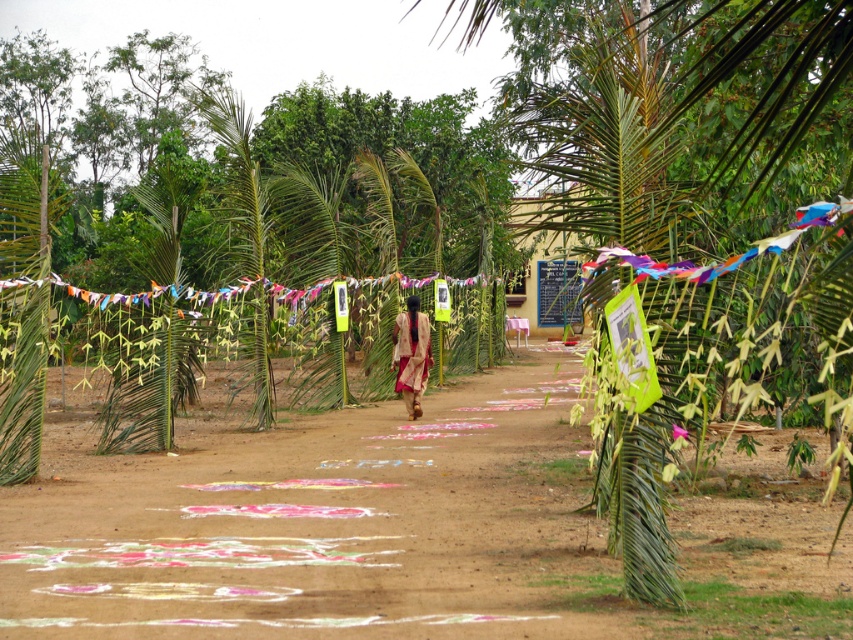
Question: Which object is the farthest from the green leafy fence at center?

Choices:
 (A) matte pink saree at center
 (B) green leafy palm tree at center
 (C) colorful fabric banner at center
 (D) colored sand art at center

Answer: (B)

Question: Which of the following is the farthest from the observer?

Choices:
 (A) click(x=646, y=230)
 (B) click(x=511, y=568)
 (C) click(x=184, y=317)
 (D) click(x=430, y=349)

Answer: (D)

Question: Can you confirm if green leafy palm tree at center is smaller than colorful fabric banner at center?

Choices:
 (A) yes
 (B) no

Answer: (B)

Question: Which of the following is the farthest from the observer?

Choices:
 (A) (659, 516)
 (B) (543, 384)
 (C) (99, 452)
 (D) (155, 289)

Answer: (B)

Question: Does green leafy palm tree at center have a larger size compared to matte pink saree at center?

Choices:
 (A) yes
 (B) no

Answer: (A)

Question: Is colored sand art at center smaller than green leafy palm tree at center?

Choices:
 (A) yes
 (B) no

Answer: (A)